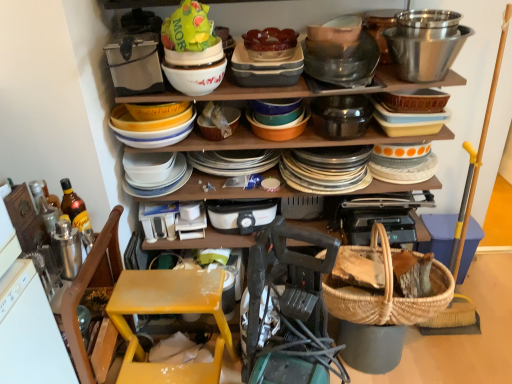
Question: Can you confirm if polished stainless steel bowl at upper right, the second bucket viewed from the left, is bigger than woven straw basket at lower center, which appears as the 2th basket when viewed from the front?

Choices:
 (A) no
 (B) yes

Answer: (A)

Question: Are polished stainless steel bowl at upper right, the second bucket viewed from the left, and woven straw basket at lower center, placed as the 2th basket when sorted from top to bottom, located far from each other?

Choices:
 (A) no
 (B) yes

Answer: (B)

Question: Is polished stainless steel bowl at upper right, the second bucket viewed from the left, thinner than woven straw basket at lower center, the 1th basket in the back-to-front sequence?

Choices:
 (A) yes
 (B) no

Answer: (B)

Question: Considering the relative sizes of polished stainless steel bowl at upper right, which is counted as the 1th bucket, starting from the right, and woven straw basket at lower center, which ranks as the 1th basket in bottom-to-top order, in the image provided, is polished stainless steel bowl at upper right, which is counted as the 1th bucket, starting from the right, shorter than woven straw basket at lower center, which ranks as the 1th basket in bottom-to-top order,?

Choices:
 (A) yes
 (B) no

Answer: (A)

Question: Can you confirm if polished stainless steel bowl at upper right, the second bucket viewed from the left, is smaller than woven straw basket at lower center, which ranks as the 1th basket in bottom-to-top order?

Choices:
 (A) yes
 (B) no

Answer: (A)

Question: Are polished stainless steel bowl at upper right, which is counted as the 1th bucket, starting from the right, and woven straw basket at lower center, placed as the 2th basket when sorted from top to bottom, making contact?

Choices:
 (A) yes
 (B) no

Answer: (B)

Question: Is the depth of green plastic bag at upper center greater than that of matte ceramic dishes at center?

Choices:
 (A) yes
 (B) no

Answer: (B)

Question: Is the surface of green plastic bag at upper center in direct contact with matte ceramic dishes at center?

Choices:
 (A) no
 (B) yes

Answer: (A)

Question: Considering the relative sizes of green plastic bag at upper center and matte ceramic dishes at center in the image provided, is green plastic bag at upper center shorter than matte ceramic dishes at center?

Choices:
 (A) no
 (B) yes

Answer: (B)

Question: Is green plastic bag at upper center thinner than matte ceramic dishes at center?

Choices:
 (A) no
 (B) yes

Answer: (B)

Question: Is green plastic bag at upper center not near matte ceramic dishes at center?

Choices:
 (A) no
 (B) yes

Answer: (A)

Question: Considering the relative sizes of green plastic bag at upper center and matte ceramic dishes at center in the image provided, is green plastic bag at upper center smaller than matte ceramic dishes at center?

Choices:
 (A) no
 (B) yes

Answer: (B)

Question: From the image's perspective, is yellow plastic step stool at lower left above polished stainless steel bowl at upper right, the second bucket viewed from the left?

Choices:
 (A) no
 (B) yes

Answer: (A)